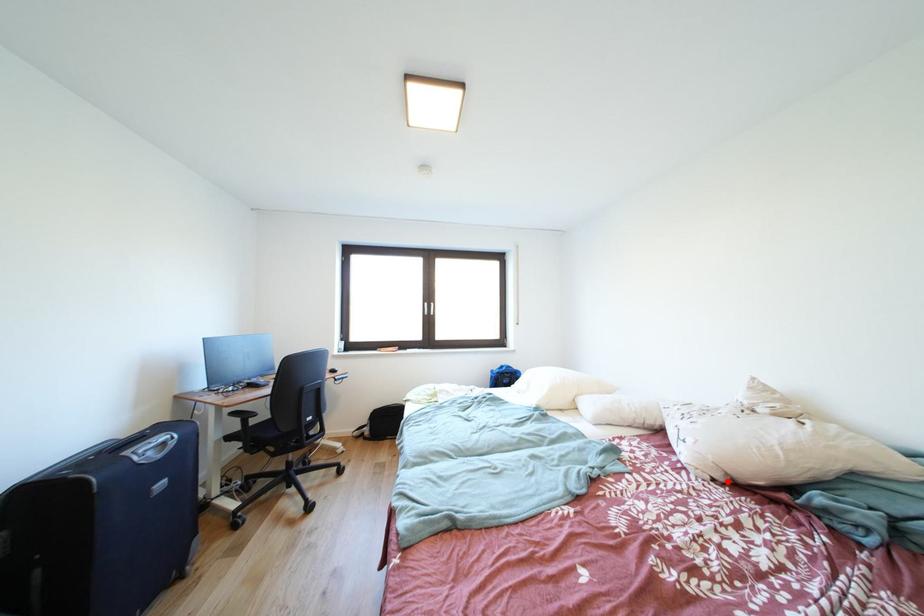
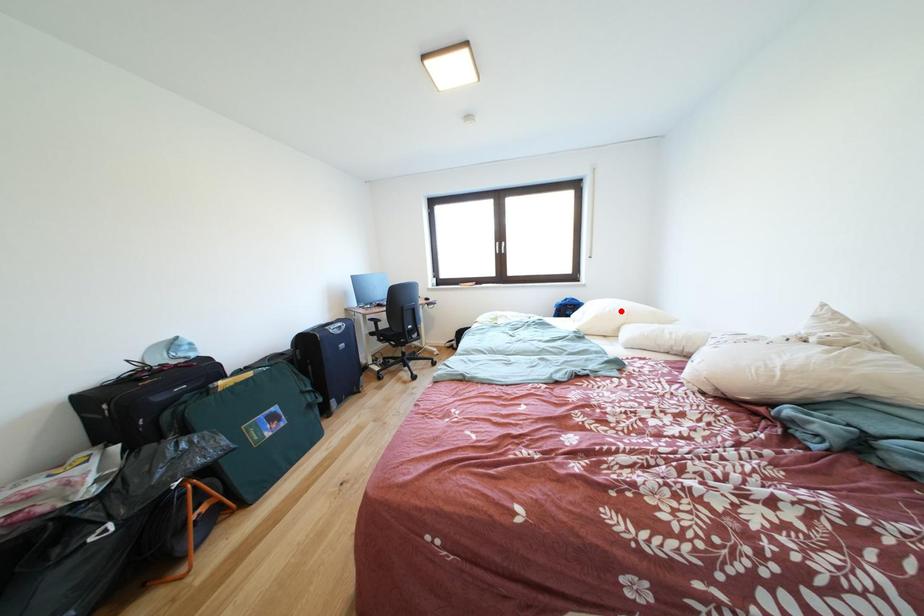
I am providing you with two images of the same scene from different viewpoints. A red point is marked on the first image and another point is marked on the second image. Is the marked point in image1 the same physical position as the marked point in image2?

No